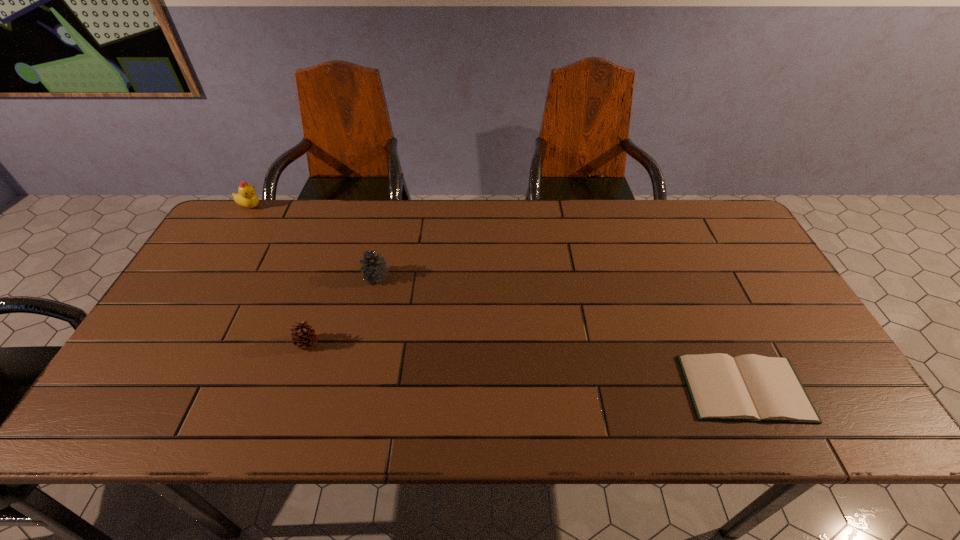
This screenshot has width=960, height=540. What are the coordinates of `vacant region at the left edge` in the screenshot? It's located at (201, 321).

In the image, there is a desktop. At what (x,y) coordinates should I click in order to perform the action: click on vacant space at the right edge. Please return your answer as a coordinate pair (x, y). The image size is (960, 540). Looking at the image, I should click on (750, 289).

The width and height of the screenshot is (960, 540). Find the location of `vacant region at the far right corner of the desktop`. vacant region at the far right corner of the desktop is located at coordinates (735, 223).

I want to click on free point between the third object from right to left and the right pinecone, so click(x=342, y=310).

Image resolution: width=960 pixels, height=540 pixels. I want to click on empty space between the rightmost object and the left pinecone, so click(526, 366).

Where is `vacant point located between the rightmost object and the second nearest object`? This screenshot has width=960, height=540. vacant point located between the rightmost object and the second nearest object is located at coordinates (526, 366).

At what (x,y) coordinates should I click in order to perform the action: click on vacant region between the right pinecone and the nearest object. Please return your answer as a coordinate pair (x, y). Looking at the image, I should click on (561, 333).

You are a GUI agent. You are given a task and a screenshot of the screen. Output one action in this format:
    pyautogui.click(x=<x>, y=<y>)
    Task: Click on the vacant space that is in between the second farthest object and the left pinecone
    This screenshot has height=540, width=960.
    Given the screenshot: What is the action you would take?
    pyautogui.click(x=342, y=310)

The width and height of the screenshot is (960, 540). Identify the location of free area in between the third object from right to left and the leftmost object. (278, 275).

Find the location of a particular element. This screenshot has height=540, width=960. free area in between the left pinecone and the rightmost object is located at coordinates (526, 366).